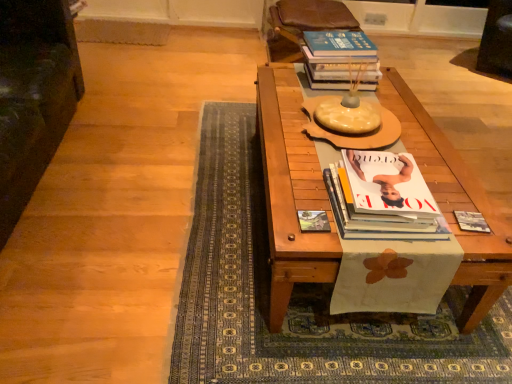
Find the location of a particular element. This screenshot has width=512, height=384. free area behind matte paper book cover at center is located at coordinates (302, 192).